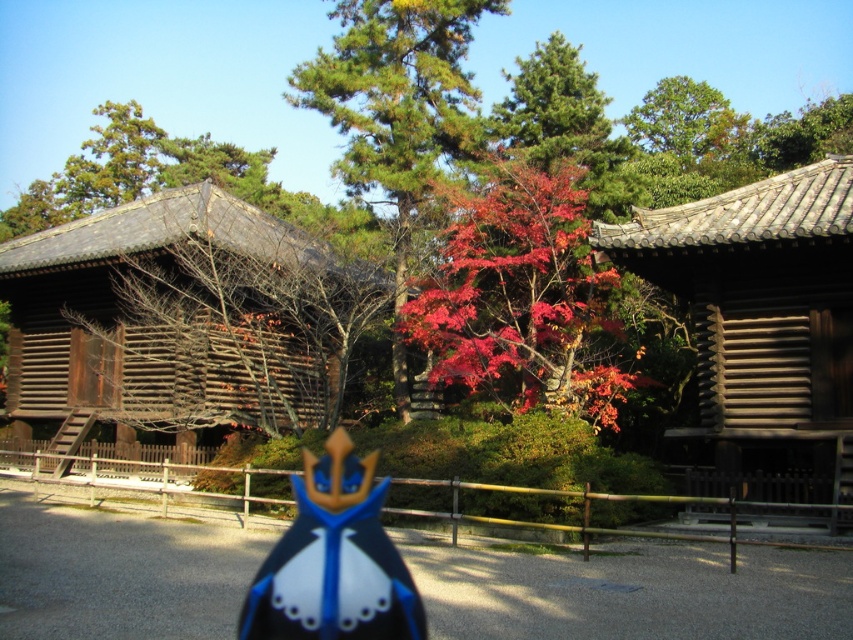
Is point (299, 532) positioned in front of point (646, 138)?

Yes, point (299, 532) is in front of point (646, 138).

Can you confirm if blue glossy crown at center is positioned below green leafy tree at upper center?

Correct, blue glossy crown at center is located below green leafy tree at upper center.

Image resolution: width=853 pixels, height=640 pixels. I want to click on blue glossy crown at center, so click(334, 561).

Which is more to the left, wooden hut at left or wooden shingles hut at right?

From the viewer's perspective, wooden hut at left appears more on the left side.

This screenshot has width=853, height=640. Find the location of `wooden hut at left`. wooden hut at left is located at coordinates (180, 320).

Between point (834, 246) and point (344, 513), which one is positioned in front?

Point (834, 246) is more forward.

Describe the element at coordinates (761, 324) in the screenshot. Image resolution: width=853 pixels, height=640 pixels. I see `wooden shingles hut at right` at that location.

At what (x,y) coordinates should I click in order to perform the action: click on wooden shingles hut at right. Please return your answer as a coordinate pair (x, y). This screenshot has width=853, height=640. Looking at the image, I should click on click(x=761, y=324).